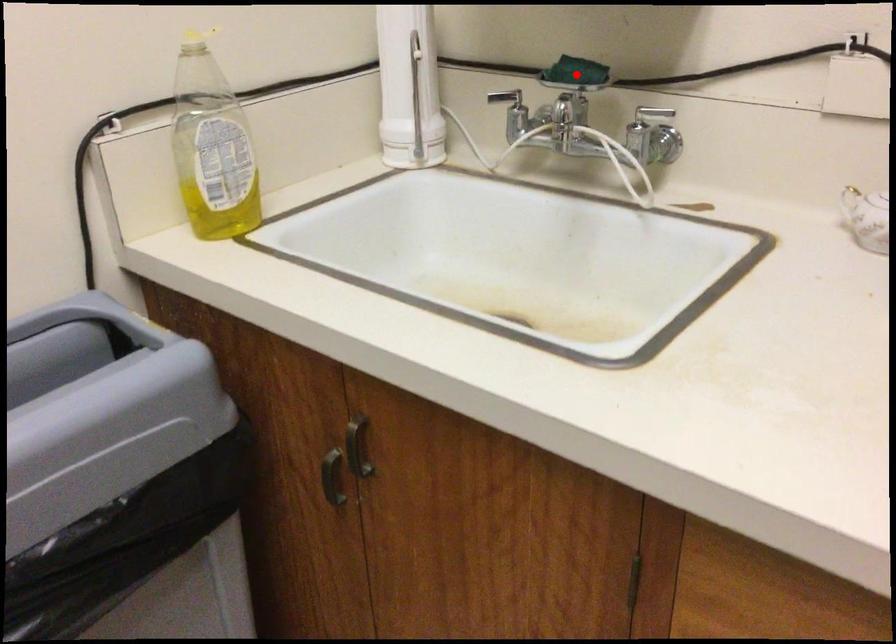
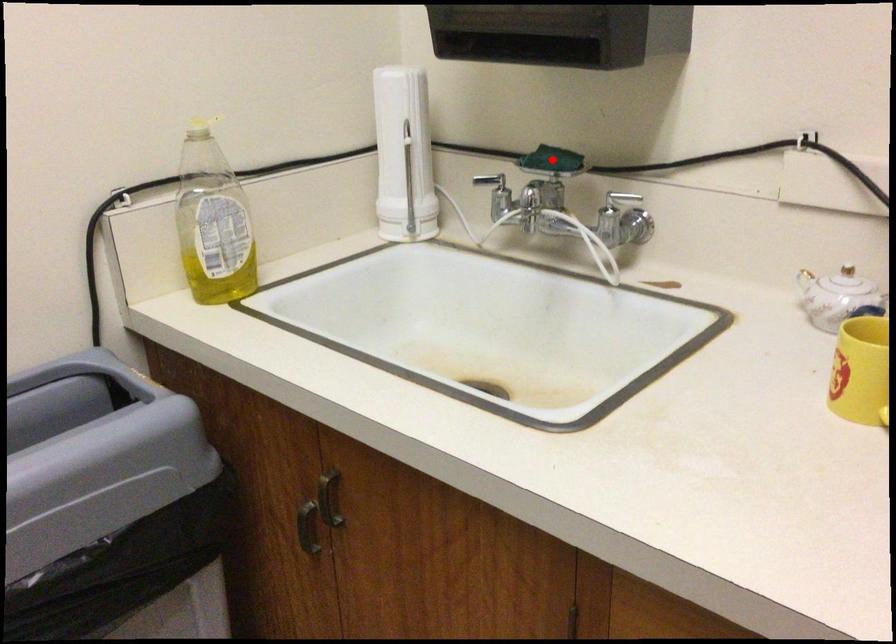
I am providing you with two images of the same scene from different viewpoints. A red point is marked on the first image and another point is marked on the second image. Do the highlighted points in image1 and image2 indicate the same real-world spot?

Yes